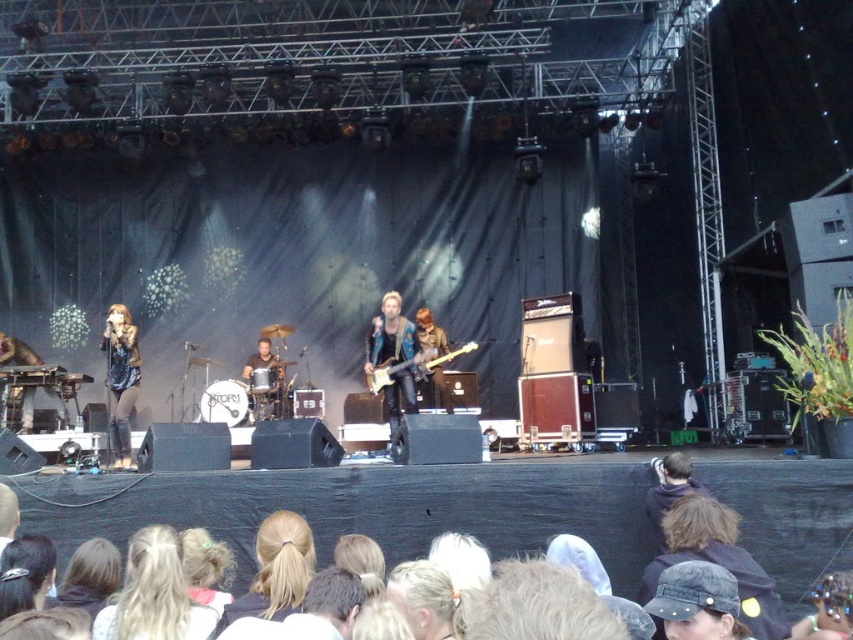
Question: Is shiny blue guitar at center thinner than glossy electric guitar at center?

Choices:
 (A) yes
 (B) no

Answer: (A)

Question: Does fur coat at center have a larger size compared to glossy electric guitar at center?

Choices:
 (A) yes
 (B) no

Answer: (A)

Question: Can you confirm if blonde hair at lower center is positioned to the right of shiny blue guitar at center?

Choices:
 (A) no
 (B) yes

Answer: (A)

Question: Estimate the real-world distances between objects in this image. Which object is farther from the shiny blue guitar at center?

Choices:
 (A) dark brown hair at lower right
 (B) shiny blue jacket at center
 (C) denim cap at lower right
 (D) blonde hair at center

Answer: (D)

Question: Which point is closer to the camera taking this photo?

Choices:
 (A) (657, 468)
 (B) (660, 557)
 (C) (126, 339)
 (D) (378, 368)

Answer: (B)

Question: Which object is closer to the camera taking this photo?

Choices:
 (A) denim cap at lower right
 (B) dark brown hair at lower right
 (C) fur coat at center

Answer: (A)